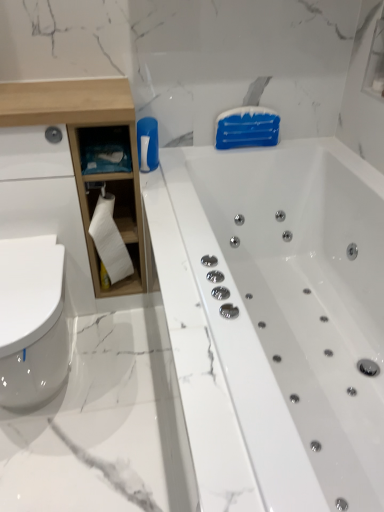
Where is `free spot above white glossy toilet at lower left (from a real-world perspective)`? The image size is (384, 512). free spot above white glossy toilet at lower left (from a real-world perspective) is located at coordinates (31, 278).